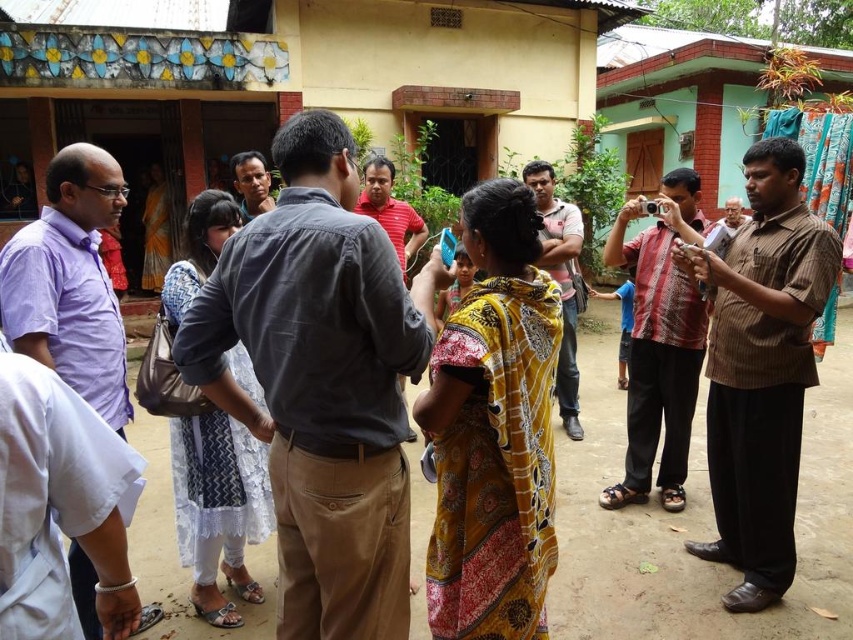
Is reddish-brown woven shirt at center above light brown shirt at center?

No.

Does reddish-brown woven shirt at center have a lesser width compared to light brown shirt at center?

No, reddish-brown woven shirt at center is not thinner than light brown shirt at center.

Is point (674, 346) positioned in front of point (556, 371)?

Yes.

The image size is (853, 640). What are the coordinates of `reddish-brown woven shirt at center` in the screenshot? It's located at click(660, 342).

Which of these two, dark gray corduroy shirt at center or brown striped shirt at right, stands taller?

Standing taller between the two is brown striped shirt at right.

Which is below, dark gray corduroy shirt at center or brown striped shirt at right?

brown striped shirt at right is below.

The width and height of the screenshot is (853, 640). Find the location of `dark gray corduroy shirt at center`. dark gray corduroy shirt at center is located at coordinates (322, 381).

At what (x,y) coordinates should I click in order to perform the action: click on dark gray corduroy shirt at center. Please return your answer as a coordinate pair (x, y). The image size is (853, 640). Looking at the image, I should click on (322, 381).

Does purple cotton shirt at center appear over matte black shirt at center?

No.

In the scene shown: Which of these two, purple cotton shirt at center or matte black shirt at center, stands taller?

purple cotton shirt at center is taller.

Between point (74, 588) and point (236, 179), which one is positioned behind?

Point (236, 179)

Where is `purple cotton shirt at center`? The image size is (853, 640). purple cotton shirt at center is located at coordinates point(70,282).